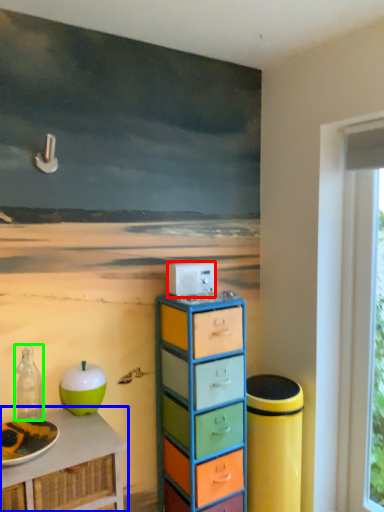
Question: Which is farther away from appliance (highlighted by a red box)? table (highlighted by a blue box) or bottle (highlighted by a green box)?

Choices:
 (A) table
 (B) bottle

Answer: (A)